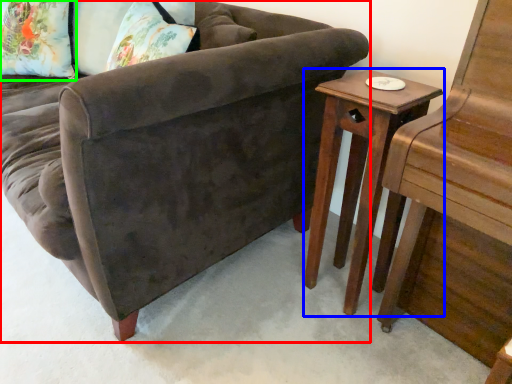
Question: Which object is positioned closest to studio couch (highlighted by a red box)? Select from table (highlighted by a blue box) and pillow (highlighted by a green box).

Choices:
 (A) table
 (B) pillow

Answer: (A)